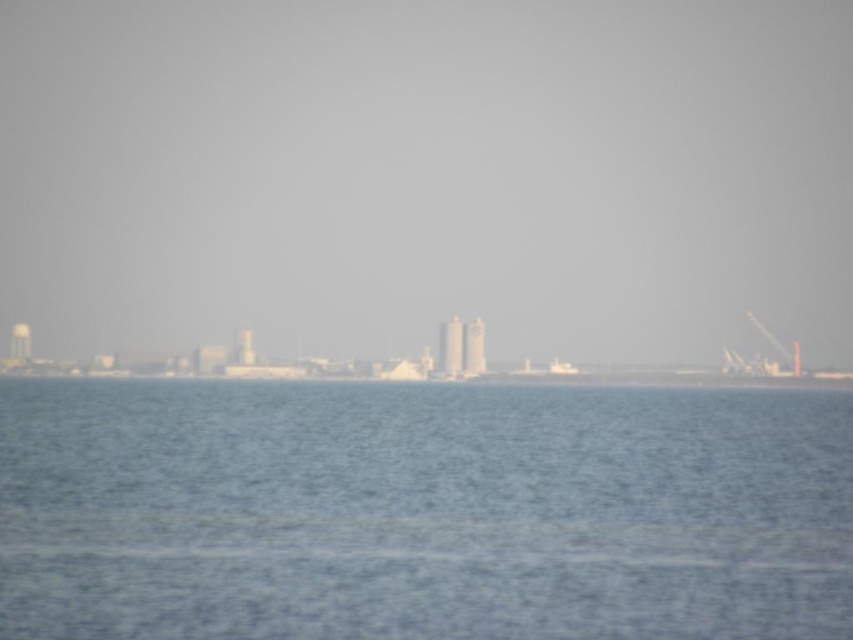
Who is positioned more to the right, transparent glass skyscraper at center or blue water at center?

blue water at center

Who is shorter, transparent glass skyscraper at center or blue water at center?

Standing shorter between the two is blue water at center.

Between point (718, 141) and point (805, 422), which one is positioned behind?

Positioned behind is point (718, 141).

Locate an element on the screen. This screenshot has height=640, width=853. transparent glass skyscraper at center is located at coordinates (427, 176).